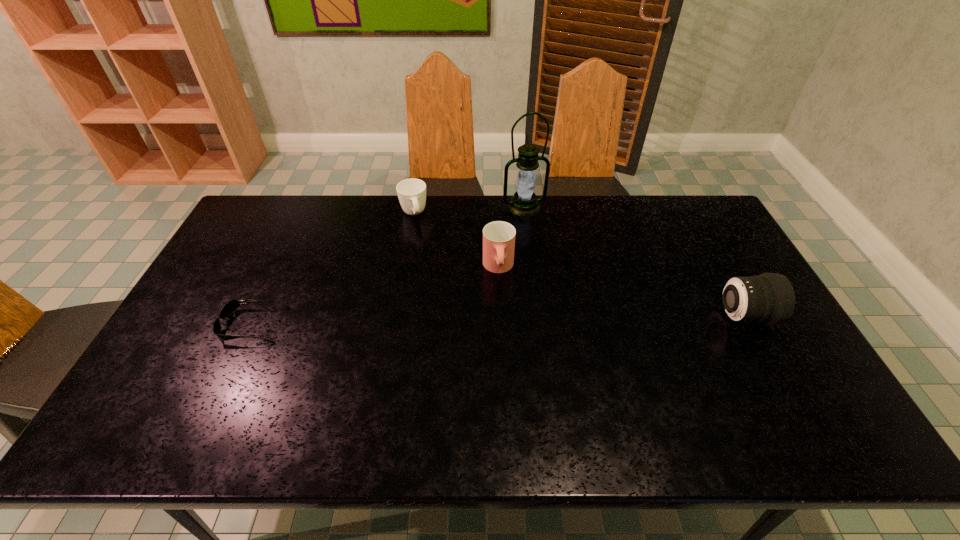
At what (x,y) coordinates should I click in order to perform the action: click on free spot located 0.070m on the side where the lantern emits light. Please return your answer as a coordinate pair (x, y). This screenshot has height=540, width=960. Looking at the image, I should click on (534, 228).

This screenshot has height=540, width=960. I want to click on vacant area situated 0.240m on the side where the lantern emits light, so click(x=546, y=262).

Image resolution: width=960 pixels, height=540 pixels. I want to click on vacant position located 0.360m on the side where the lantern emits light, so click(558, 289).

Locate an element on the screen. The width and height of the screenshot is (960, 540). free space located 0.210m on the side of the right cup with the handle is located at coordinates (504, 340).

Where is `free space located 0.270m on the side of the right cup with the handle`? This screenshot has height=540, width=960. free space located 0.270m on the side of the right cup with the handle is located at coordinates (506, 358).

In order to click on vacant space situated 0.310m on the side of the right cup with the handle in this screenshot , I will do `click(507, 372)`.

In order to click on vacant region located with the handle on the side of the fourth object from right to left in this screenshot , I will do `click(420, 239)`.

You are a GUI agent. You are given a task and a screenshot of the screen. Output one action in this format:
    pyautogui.click(x=<x>, y=<y>)
    Task: Click on the free spot located 0.150m with the handle on the side of the fourth object from right to left
    
    Given the screenshot: What is the action you would take?
    pyautogui.click(x=425, y=254)

Image resolution: width=960 pixels, height=540 pixels. I want to click on vacant space positioned 0.360m with the handle on the side of the fourth object from right to left, so click(x=440, y=300).

Where is `lantern that is at the far edge`? The height and width of the screenshot is (540, 960). lantern that is at the far edge is located at coordinates (524, 203).